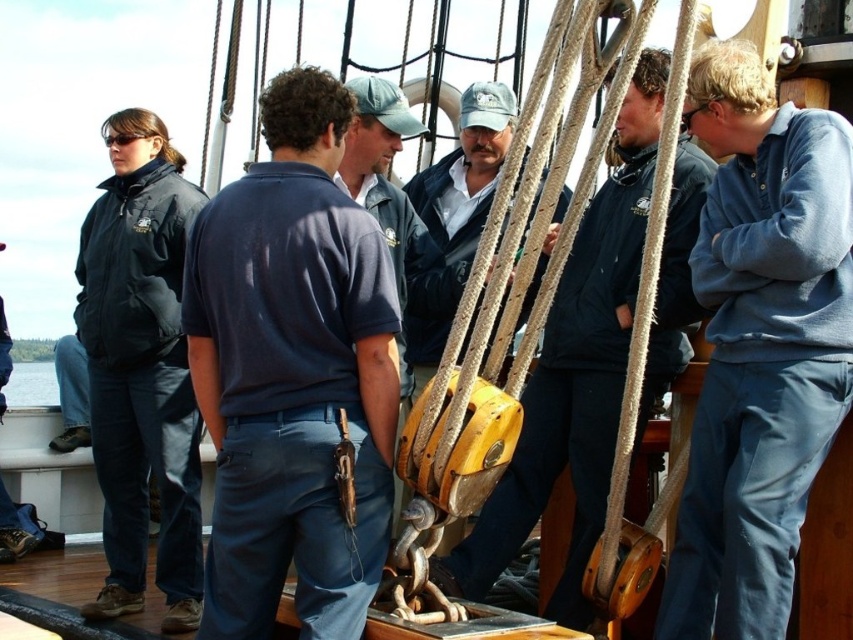
Question: Can you confirm if light blue fleece at right is positioned to the right of black matte jacket at left?

Choices:
 (A) yes
 (B) no

Answer: (A)

Question: Does dark blue jacket at center appear on the right side of black matte jacket at left?

Choices:
 (A) yes
 (B) no

Answer: (A)

Question: Which point is farther from the camera taking this photo?

Choices:
 (A) (795, 276)
 (B) (160, 172)

Answer: (B)

Question: Can you confirm if light blue fleece at right is bigger than black matte jacket at left?

Choices:
 (A) yes
 (B) no

Answer: (B)

Question: Which of the following is the farthest from the observer?

Choices:
 (A) dark blue cotton polo shirt at center
 (B) black matte jacket at left

Answer: (B)

Question: Which is farther from the dark blue cotton polo shirt at center?

Choices:
 (A) black matte jacket at left
 (B) light blue fleece at right
 (C) dark blue jacket at center

Answer: (B)